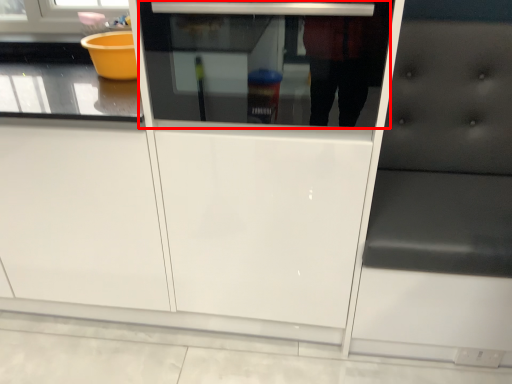
Question: From the image's perspective, where is oven (annotated by the red box) located in relation to furniture in the image?

Choices:
 (A) below
 (B) above

Answer: (B)